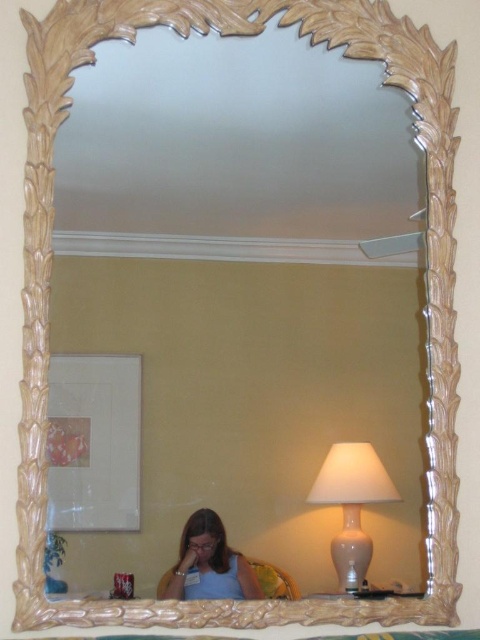
Which is in front, point (346, 586) or point (244, 572)?

Point (244, 572) is more forward.

How much distance is there between white glossy lamp at lower right and matte blue shirt at lower center?

white glossy lamp at lower right and matte blue shirt at lower center are 8.50 inches apart from each other.

Which is behind, point (333, 465) or point (206, 577)?

Point (333, 465)

Find the location of a particular element. Image resolution: width=480 pixels, height=640 pixels. white glossy lamp at lower right is located at coordinates (351, 504).